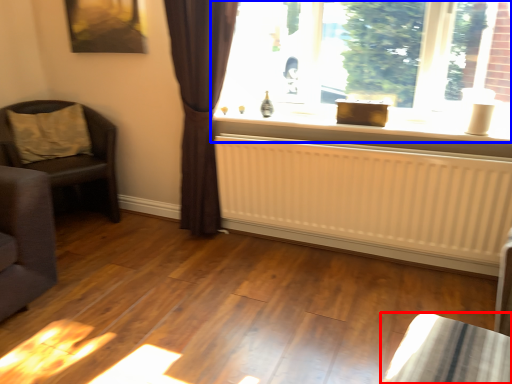
Question: Which object is closer to the camera taking this photo, furniture (highlighted by a red box) or window (highlighted by a blue box)?

Choices:
 (A) furniture
 (B) window

Answer: (A)